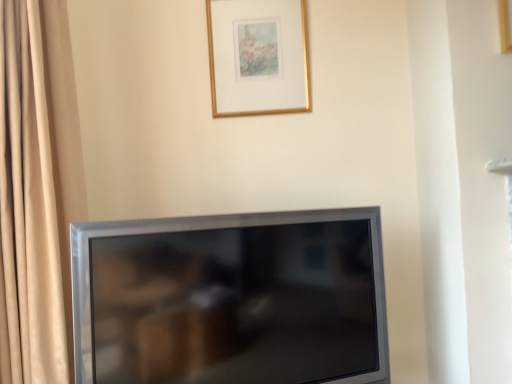
What do you see at coordinates (258, 57) in the screenshot? Image resolution: width=512 pixels, height=384 pixels. I see `gold metallic picture frame at upper center` at bounding box center [258, 57].

I want to click on gold metallic picture frame at upper center, so click(x=258, y=57).

Consider the image. What is the approximate width of gold metallic picture frame at upper center?

It is 1.73 inches.

Measure the distance between satin silver tv at lower center and camera.

3.41 feet.

The image size is (512, 384). Identify the location of satin silver tv at lower center. [x=231, y=299].

The image size is (512, 384). What do you see at coordinates (231, 299) in the screenshot?
I see `satin silver tv at lower center` at bounding box center [231, 299].

This screenshot has width=512, height=384. What are the coordinates of `gold metallic picture frame at upper center` in the screenshot? It's located at (258, 57).

Does gold metallic picture frame at upper center appear on the left side of satin silver tv at lower center?

Incorrect, gold metallic picture frame at upper center is not on the left side of satin silver tv at lower center.

Considering the positions of objects gold metallic picture frame at upper center and satin silver tv at lower center in the image provided, who is behind, gold metallic picture frame at upper center or satin silver tv at lower center?

gold metallic picture frame at upper center is further from the camera.

Considering the positions of points (292, 31) and (285, 285), is point (292, 31) closer to camera compared to point (285, 285)?

No, it is not.

From the image's perspective, is gold metallic picture frame at upper center under satin silver tv at lower center?

Incorrect, from the image's perspective, gold metallic picture frame at upper center is higher than satin silver tv at lower center.

From a real-world perspective, which is physically above, gold metallic picture frame at upper center or satin silver tv at lower center?

gold metallic picture frame at upper center, from a real-world perspective.

Can you confirm if gold metallic picture frame at upper center is wider than satin silver tv at lower center?

In fact, gold metallic picture frame at upper center might be narrower than satin silver tv at lower center.

Considering the sizes of objects gold metallic picture frame at upper center and satin silver tv at lower center in the image provided, who is taller, gold metallic picture frame at upper center or satin silver tv at lower center?

Result: With more height is satin silver tv at lower center.

Based on the photo, looking at the image, does gold metallic picture frame at upper center seem bigger or smaller compared to satin silver tv at lower center?

gold metallic picture frame at upper center is smaller than satin silver tv at lower center.

Choose the correct answer: Is gold metallic picture frame at upper center inside satin silver tv at lower center or outside it?

gold metallic picture frame at upper center is spatially situated outside satin silver tv at lower center.

Is gold metallic picture frame at upper center directly adjacent to satin silver tv at lower center?

No.

Is gold metallic picture frame at upper center positioned with its back to satin silver tv at lower center?

No, satin silver tv at lower center is not at the back of gold metallic picture frame at upper center.

Can you tell me how much gold metallic picture frame at upper center and satin silver tv at lower center differ in facing direction?

gold metallic picture frame at upper center and satin silver tv at lower center are facing 22.1 degrees away from each other.

Where is `picture frame above the satin silver tv at lower center (from the image's perspective)`? The width and height of the screenshot is (512, 384). picture frame above the satin silver tv at lower center (from the image's perspective) is located at coordinates (258, 57).

Considering the positions of objects satin silver tv at lower center and gold metallic picture frame at upper center in the image provided, who is more to the right, satin silver tv at lower center or gold metallic picture frame at upper center?

gold metallic picture frame at upper center.

Who is more distant, satin silver tv at lower center or gold metallic picture frame at upper center?

gold metallic picture frame at upper center.

Is point (198, 320) closer to viewer compared to point (247, 5)?

Yes.

From the image's perspective, which object appears higher, satin silver tv at lower center or gold metallic picture frame at upper center?

gold metallic picture frame at upper center appears higher in the image.

From a real-world perspective, is satin silver tv at lower center positioned above or below gold metallic picture frame at upper center?

Clearly, from a real-world perspective, satin silver tv at lower center is below gold metallic picture frame at upper center.

Considering the sizes of objects satin silver tv at lower center and gold metallic picture frame at upper center in the image provided, who is wider, satin silver tv at lower center or gold metallic picture frame at upper center?

satin silver tv at lower center is wider.

In terms of height, does satin silver tv at lower center look taller or shorter compared to gold metallic picture frame at upper center?

satin silver tv at lower center is taller than gold metallic picture frame at upper center.

Which of these two, satin silver tv at lower center or gold metallic picture frame at upper center, is smaller?

gold metallic picture frame at upper center is smaller.

Is gold metallic picture frame at upper center surrounded by satin silver tv at lower center?

No, satin silver tv at lower center does not contain gold metallic picture frame at upper center.

Would you consider satin silver tv at lower center to be distant from gold metallic picture frame at upper center?

No, satin silver tv at lower center is not far away from gold metallic picture frame at upper center.

Is satin silver tv at lower center facing towards gold metallic picture frame at upper center?

No, satin silver tv at lower center is not oriented towards gold metallic picture frame at upper center.

Locate an element on the screen. The image size is (512, 384). picture frame located behind the satin silver tv at lower center is located at coordinates (258, 57).

You are a GUI agent. You are given a task and a screenshot of the screen. Output one action in this format:
    pyautogui.click(x=<x>, y=<y>)
    Task: Click on the television in front of the gold metallic picture frame at upper center
    The width and height of the screenshot is (512, 384).
    Given the screenshot: What is the action you would take?
    [231, 299]

The width and height of the screenshot is (512, 384). I want to click on picture frame above the satin silver tv at lower center (from the image's perspective), so click(258, 57).